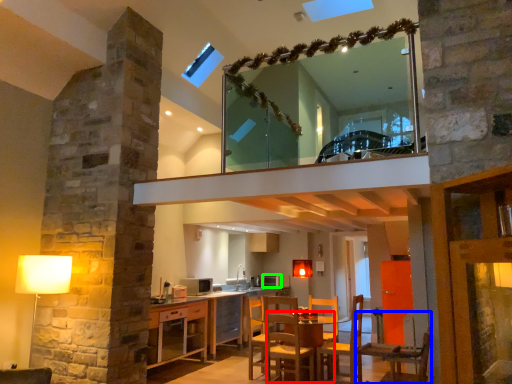
Question: Which is nearer to the table (highlighted by a red box)? chair (highlighted by a blue box) or appliance (highlighted by a green box).

Choices:
 (A) chair
 (B) appliance

Answer: (A)